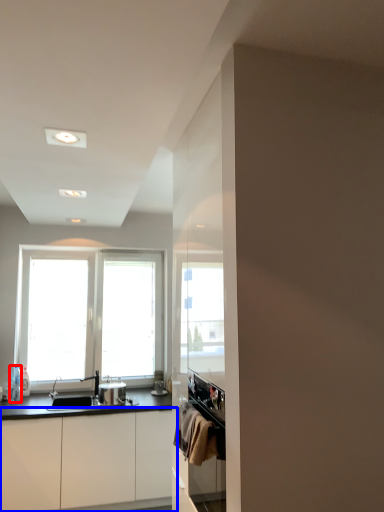
Question: Among these objects, which one is nearest to the camera, bottle (highlighted by a red box) or cabinetry (highlighted by a blue box)?

Choices:
 (A) bottle
 (B) cabinetry

Answer: (B)